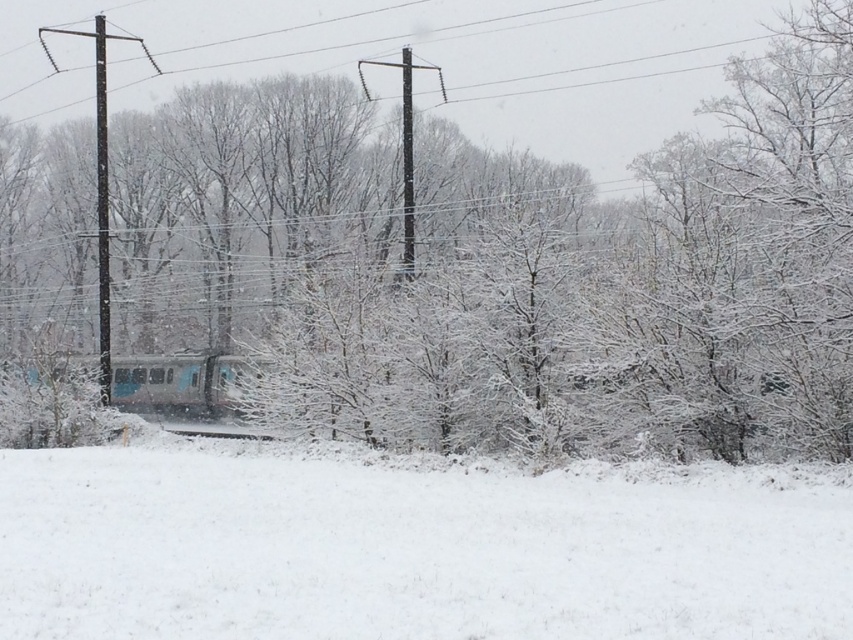
You are standing at point (477, 561). The train is 11.17 meters away from you. Is the train closer to you than the trees in the middle ground?

The train is 11.17 meters away from you, but the distance to the trees in the middle ground isn not provided. Therefore, it is impossible to determine if the train is closer than the trees.

You are a maintenance worker needing to reach the smooth concrete train track at center from the black wooden telegraph pole at left. Given that your equipment can only be carried over snow for 60 feet before it becomes too heavy, will you be able to reach the track without needing to rest?

The distance between the black wooden telegraph pole at left and the smooth concrete train track at center is 60.66 feet. Since your equipment can only be carried for 60 feet, you will need to rest before reaching the track.